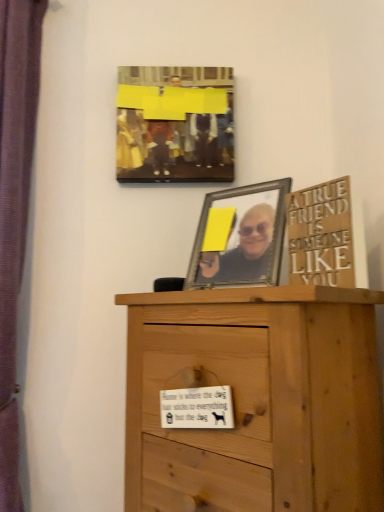
Question: Is point (339, 198) positioned closer to the camera than point (152, 145)?

Choices:
 (A) closer
 (B) farther

Answer: (A)

Question: Considering the positions of wooden sign at upper right and matte yellow canvas at upper center in the image, is wooden sign at upper right bigger or smaller than matte yellow canvas at upper center?

Choices:
 (A) big
 (B) small

Answer: (B)

Question: Estimate the real-world distances between objects in this image. Which object is farther from the purple fabric curtain at left?

Choices:
 (A) matte yellow canvas at upper center
 (B) wooden sign at upper right
 (C) light brown wood chest of drawers at center

Answer: (B)

Question: Estimate the real-world distances between objects in this image. Which object is farther from the light brown wood chest of drawers at center?

Choices:
 (A) matte yellow canvas at upper center
 (B) wooden sign at upper right
 (C) purple fabric curtain at left

Answer: (C)